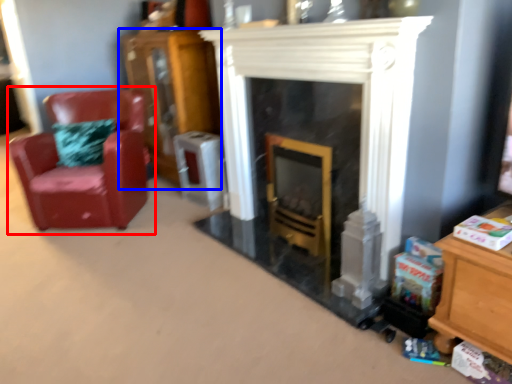
Question: Which point is further to the camera, chair (highlighted by a red box) or dresser (highlighted by a blue box)?

Choices:
 (A) chair
 (B) dresser

Answer: (B)